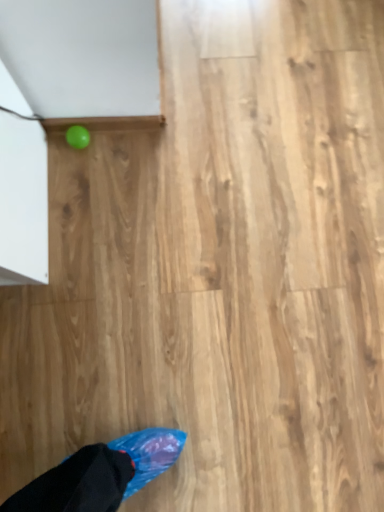
Locate an element on the screen. vacant area that lies to the right of green rubber ball at upper left is located at coordinates (130, 160).